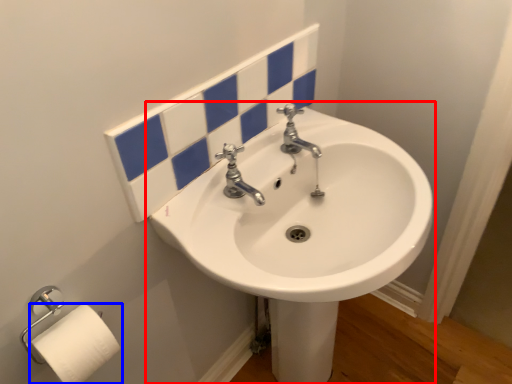
Question: Which point is closer to the camera, sink (highlighted by a red box) or toilet paper (highlighted by a blue box)?

Choices:
 (A) sink
 (B) toilet paper

Answer: (A)